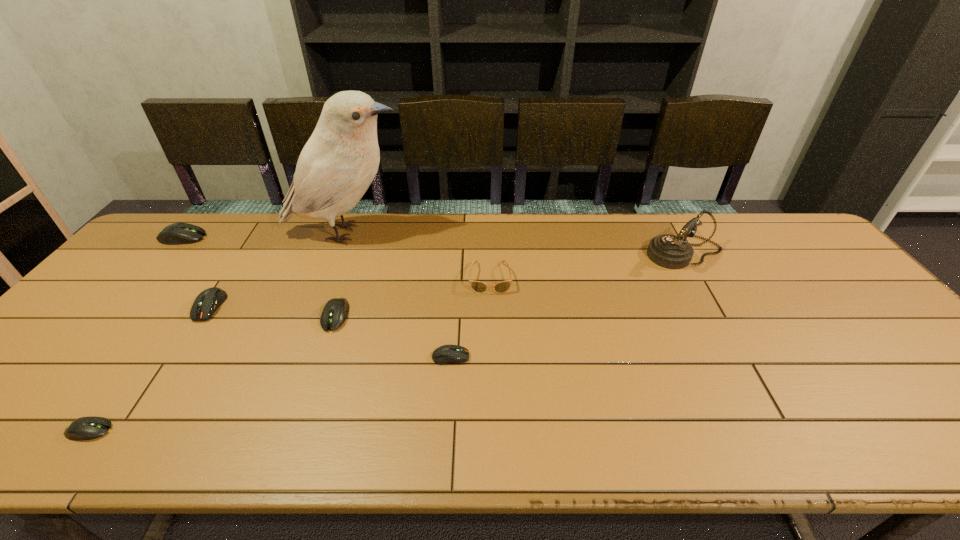
Image resolution: width=960 pixels, height=540 pixels. In order to click on the rightmost gray computer mouse in this screenshot , I will do `click(335, 312)`.

At what (x,y) coordinates should I click in order to perform the action: click on the fourth farthest computer mouse. Please return your answer as a coordinate pair (x, y). The height and width of the screenshot is (540, 960). Looking at the image, I should click on (445, 354).

You are a GUI agent. You are given a task and a screenshot of the screen. Output one action in this format:
    pyautogui.click(x=<x>, y=<y>)
    Task: Click on the smaller dark computer equipment
    This screenshot has width=960, height=540.
    Given the screenshot: What is the action you would take?
    pyautogui.click(x=445, y=354)

Find the location of `the smallest gray computer mouse`. the smallest gray computer mouse is located at coordinates (x=85, y=428).

Where is `the nearest computer mouse`? the nearest computer mouse is located at coordinates (85, 428).

The image size is (960, 540). I want to click on blank space located 0.320m on the face of the parakeet, so click(506, 233).

Where is `vacant space located on the left of the telephone`? The image size is (960, 540). vacant space located on the left of the telephone is located at coordinates (572, 253).

This screenshot has height=540, width=960. In order to click on vacant area located 0.100m on the wheel side of the farthest computer mouse in this screenshot , I will do (237, 238).

The height and width of the screenshot is (540, 960). I want to click on free region located 0.120m on the front-facing side of the sunglasses, so click(x=492, y=326).

Locate an element on the screen. The width and height of the screenshot is (960, 540). vacant point located 0.360m on the button of the farther dark computer equipment is located at coordinates (113, 455).